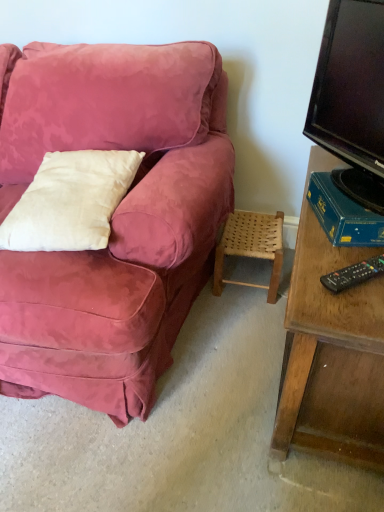
Question: Does black glossy tv at right have a greater width compared to blue cardboard book at right?

Choices:
 (A) yes
 (B) no

Answer: (B)

Question: Is blue cardboard book at right completely or partially inside black glossy tv at right?

Choices:
 (A) yes
 (B) no

Answer: (B)

Question: Does black glossy tv at right turn towards blue cardboard book at right?

Choices:
 (A) yes
 (B) no

Answer: (B)

Question: Is black glossy tv at right thinner than blue cardboard book at right?

Choices:
 (A) no
 (B) yes

Answer: (B)

Question: From a real-world perspective, does black glossy tv at right sit lower than blue cardboard book at right?

Choices:
 (A) no
 (B) yes

Answer: (A)

Question: Is black glossy tv at right smaller than blue cardboard book at right?

Choices:
 (A) yes
 (B) no

Answer: (B)

Question: Is woven wood stool at lower right positioned before white cotton pillow at left?

Choices:
 (A) no
 (B) yes

Answer: (A)

Question: Is woven wood stool at lower right wider than white cotton pillow at left?

Choices:
 (A) yes
 (B) no

Answer: (B)

Question: Is woven wood stool at lower right facing away from white cotton pillow at left?

Choices:
 (A) no
 (B) yes

Answer: (A)

Question: From a real-world perspective, is woven wood stool at lower right physically above white cotton pillow at left?

Choices:
 (A) no
 (B) yes

Answer: (A)

Question: Is woven wood stool at lower right bigger than white cotton pillow at left?

Choices:
 (A) yes
 (B) no

Answer: (B)

Question: Would you consider woven wood stool at lower right to be distant from white cotton pillow at left?

Choices:
 (A) yes
 (B) no

Answer: (B)

Question: Considering the relative sizes of black plastic remote control at lower right and black glossy tv at right in the image provided, is black plastic remote control at lower right taller than black glossy tv at right?

Choices:
 (A) no
 (B) yes

Answer: (A)